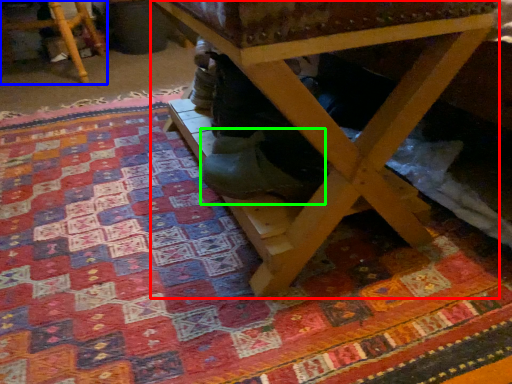
Question: Which is nearer to the table (highlighted by a red box)? furniture (highlighted by a blue box) or shoe (highlighted by a green box).

Choices:
 (A) furniture
 (B) shoe

Answer: (B)